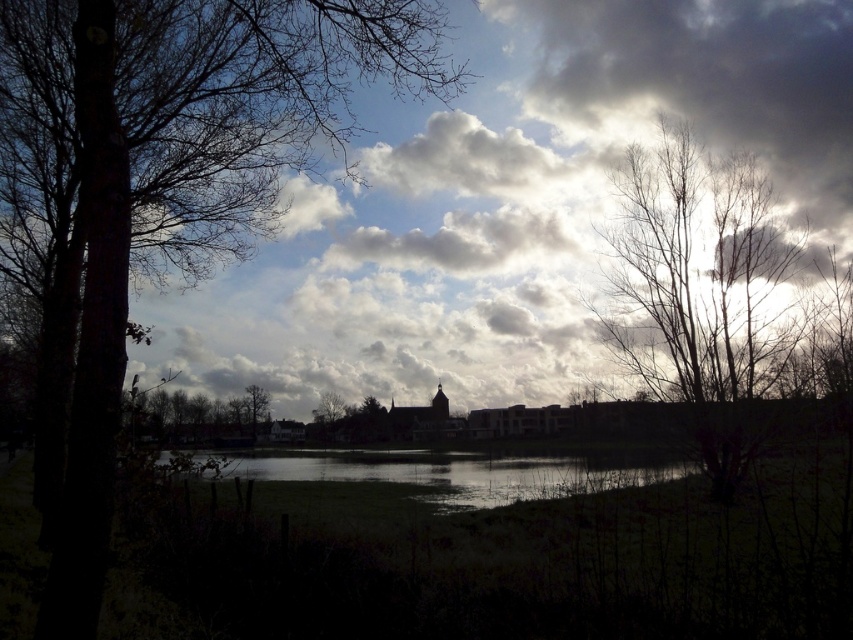
You are standing in the landscape scene and want to walk from the point at coordinates point (801, 45) to the point at coordinates point (691, 468). Which direction should you face to move towards the second point?

Point (801, 45) is further to the viewer than point (691, 468). To move towards the second point, you should face away from the viewer, which would be towards the background of the scene.

You are standing in the landscape scene described. You want to look up at the cloudy sky at upper center. In which direction should you tilt your head to see it?

The cloudy sky at upper center is located at point 0.316 on the x axis and 0.600 on the y axis. Since the y coordinate is 0.600, which is above the center of the image, you should tilt your head upward to see it.

You are an observer standing in the landscape scene. You notice the bare branches at center and the green matte tree at center. Which object is closer to you?

The bare branches at center is closer to you as it is in front of the green matte tree at center.